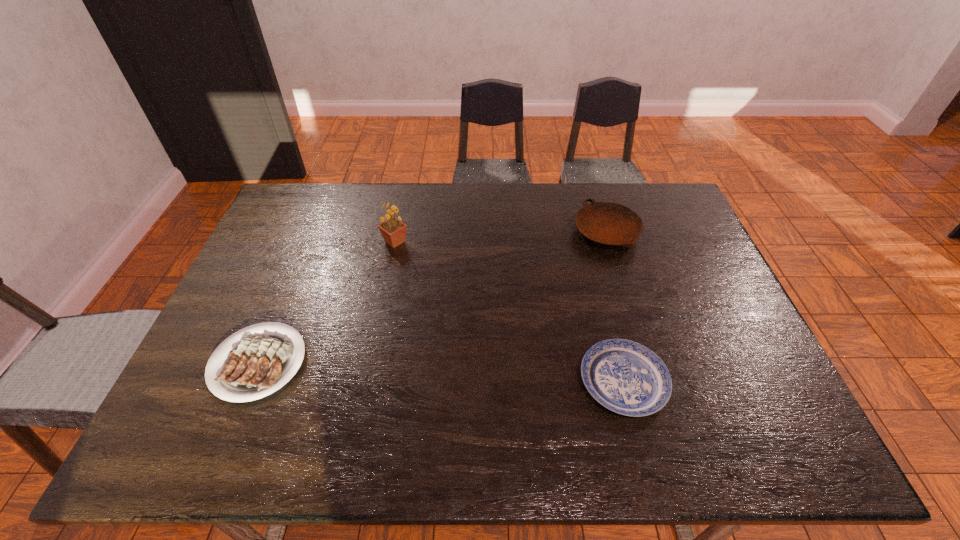
Locate which object is the third closest to the sunflower. Please provide its 2D coordinates. Your answer should be formatted as a tuple, i.e. [(x, y)], where the tuple contains the x and y coordinates of a point satisfying the conditions above.

[(624, 376)]

This screenshot has width=960, height=540. What are the coordinates of `plate identified as the closest to the leftmost object` in the screenshot? It's located at (624, 376).

Identify which plate is the third nearest to the sunflower. Please provide its 2D coordinates. Your answer should be formatted as a tuple, i.e. [(x, y)], where the tuple contains the x and y coordinates of a point satisfying the conditions above.

[(624, 376)]

You are a GUI agent. You are given a task and a screenshot of the screen. Output one action in this format:
    pyautogui.click(x=<x>, y=<y>)
    Task: Click on the vacant region that satisfies the following two spatial constraints: 1. on the front side of the farthest plate; 2. at the front of the second object from left to right with flowers visible
    This screenshot has height=540, width=960.
    Given the screenshot: What is the action you would take?
    pyautogui.click(x=609, y=242)